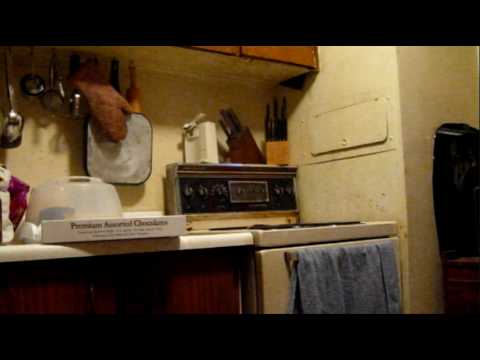
Where is `edge of cabinets`? This screenshot has width=480, height=360. edge of cabinets is located at coordinates [x=296, y=46], [x=272, y=54].